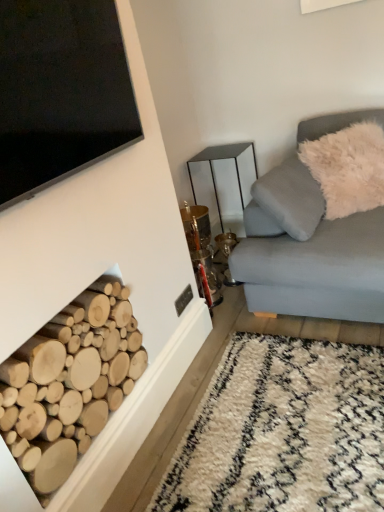
Image resolution: width=384 pixels, height=512 pixels. What do you see at coordinates (69, 383) in the screenshot?
I see `natural wood logs at lower left` at bounding box center [69, 383].

Locate an element on the screen. This screenshot has width=384, height=512. metallic mirrored table at center is located at coordinates 221,159.

In order to face white shaggy rug at lower right, should I rotate leftwards or rightwards?

It's best to rotate right around 12.165 degrees.

The width and height of the screenshot is (384, 512). What do you see at coordinates (348, 168) in the screenshot? I see `white fluffy pillow at upper right` at bounding box center [348, 168].

Identify the location of natural wood logs at lower left. The height and width of the screenshot is (512, 384). (69, 383).

Is metallic mirrored table at center in front of or behind white shaggy rug at lower right in the image?

Visually, metallic mirrored table at center is located behind white shaggy rug at lower right.

From the image's perspective, is metallic mirrored table at center under white shaggy rug at lower right?

No, from the image's perspective, metallic mirrored table at center is not below white shaggy rug at lower right.

Is metallic mirrored table at center situated inside white shaggy rug at lower right or outside?

metallic mirrored table at center lies outside white shaggy rug at lower right.

Between metallic mirrored table at center and white shaggy rug at lower right, which one appears on the right side from the viewer's perspective?

Positioned to the right is white shaggy rug at lower right.

Between white shaggy rug at lower right and metallic mirrored table at center, which one has larger width?

white shaggy rug at lower right is wider.

Does white shaggy rug at lower right have a greater height compared to metallic mirrored table at center?

In fact, white shaggy rug at lower right may be shorter than metallic mirrored table at center.

Is point (373, 479) closer to viewer compared to point (204, 151)?

Yes, point (373, 479) is closer to viewer.

Considering the sizes of objects white shaggy rug at lower right and metallic mirrored table at center in the image provided, who is bigger, white shaggy rug at lower right or metallic mirrored table at center?

Bigger between the two is metallic mirrored table at center.

Which object is positioned more to the right, metallic mirrored table at center or white fluffy pillow at upper right?

white fluffy pillow at upper right is more to the right.

Are metallic mirrored table at center and white fluffy pillow at upper right located far from each other?

They are positioned close to each other.

Is metallic mirrored table at center positioned behind white fluffy pillow at upper right?

That is True.

From the image's perspective, relative to white fluffy pillow at upper right, is metallic mirrored table at center above or below?

metallic mirrored table at center is situated lower than white fluffy pillow at upper right in the image.

Which object is closer to the camera, white shaggy rug at lower right or natural wood logs at lower left?

natural wood logs at lower left is more forward.

Is white shaggy rug at lower right oriented away from natural wood logs at lower left?

white shaggy rug at lower right is not turned away from natural wood logs at lower left.

Can you confirm if white shaggy rug at lower right is bigger than natural wood logs at lower left?

No, white shaggy rug at lower right is not bigger than natural wood logs at lower left.

How different are the orientations of white shaggy rug at lower right and natural wood logs at lower left in degrees?

0.42 degrees.

Which is more to the left, white shaggy rug at lower right or white fluffy pillow at upper right?

white shaggy rug at lower right is more to the left.

At what (x,y) coordinates should I click in order to perform the action: click on pillow above the white shaggy rug at lower right (from a real-world perspective). Please return your answer as a coordinate pair (x, y). Image resolution: width=384 pixels, height=512 pixels. Looking at the image, I should click on (348, 168).

Can you confirm if white shaggy rug at lower right is shorter than white fluffy pillow at upper right?

Indeed, white shaggy rug at lower right has a lesser height compared to white fluffy pillow at upper right.

Who is bigger, white shaggy rug at lower right or white fluffy pillow at upper right?

Bigger between the two is white fluffy pillow at upper right.

Considering the sizes of metallic mirrored table at center and natural wood logs at lower left in the image, is metallic mirrored table at center bigger or smaller than natural wood logs at lower left?

metallic mirrored table at center is bigger than natural wood logs at lower left.

Between metallic mirrored table at center and natural wood logs at lower left, which one has larger width?

metallic mirrored table at center is wider.

Which is correct: metallic mirrored table at center is inside natural wood logs at lower left, or outside of it?

metallic mirrored table at center cannot be found inside natural wood logs at lower left.

Between metallic mirrored table at center and natural wood logs at lower left, which one is positioned behind?

metallic mirrored table at center is further away from the camera.

Which object is further away from the camera, white fluffy pillow at upper right or natural wood logs at lower left?

white fluffy pillow at upper right.

Is white fluffy pillow at upper right shorter than natural wood logs at lower left?

Answer: No.

Would you say white fluffy pillow at upper right contains natural wood logs at lower left?

No, white fluffy pillow at upper right does not contain natural wood logs at lower left.

Who is smaller, white fluffy pillow at upper right or natural wood logs at lower left?

Smaller between the two is natural wood logs at lower left.

Where is `plain on the right of metallic mirrored table at center`? plain on the right of metallic mirrored table at center is located at coordinates (283, 431).

I want to click on plain below the metallic mirrored table at center (from a real-world perspective), so click(283, 431).

Looking at this image, when comparing their distances from natural wood logs at lower left, does white shaggy rug at lower right or white fluffy pillow at upper right seem further?

white fluffy pillow at upper right is further to natural wood logs at lower left.

Considering their positions, is natural wood logs at lower left positioned further to white shaggy rug at lower right than white fluffy pillow at upper right?

Based on the image, white fluffy pillow at upper right appears to be further to white shaggy rug at lower right.

Looking at the image, which one is located closer to natural wood logs at lower left, white shaggy rug at lower right or metallic mirrored table at center?

white shaggy rug at lower right.

From the image, which object appears to be nearer to white shaggy rug at lower right, metallic mirrored table at center or white fluffy pillow at upper right?

The object closer to white shaggy rug at lower right is white fluffy pillow at upper right.

Considering their positions, is white fluffy pillow at upper right positioned further to white shaggy rug at lower right than natural wood logs at lower left?

The object further to white shaggy rug at lower right is white fluffy pillow at upper right.

Estimate the real-world distances between objects in this image. Which object is closer to metallic mirrored table at center, white fluffy pillow at upper right or white shaggy rug at lower right?

Based on the image, white fluffy pillow at upper right appears to be nearer to metallic mirrored table at center.

Looking at the image, which one is located closer to metallic mirrored table at center, natural wood logs at lower left or white shaggy rug at lower right?

The object closer to metallic mirrored table at center is white shaggy rug at lower right.

Which object lies further to the anchor point natural wood logs at lower left, white fluffy pillow at upper right or metallic mirrored table at center?

metallic mirrored table at center is positioned further to the anchor natural wood logs at lower left.

Locate an element on the screen. The width and height of the screenshot is (384, 512). plain between natural wood logs at lower left and white fluffy pillow at upper right is located at coordinates (283, 431).

Where is `pillow between natural wood logs at lower left and metallic mirrored table at center along the z-axis`? This screenshot has width=384, height=512. pillow between natural wood logs at lower left and metallic mirrored table at center along the z-axis is located at coordinates (348, 168).

This screenshot has height=512, width=384. Find the location of `pillow between white shaggy rug at lower right and metallic mirrored table at center from front to back`. pillow between white shaggy rug at lower right and metallic mirrored table at center from front to back is located at coordinates (348, 168).

Locate an element on the screen. This screenshot has width=384, height=512. plain between natural wood logs at lower left and metallic mirrored table at center along the z-axis is located at coordinates (283, 431).